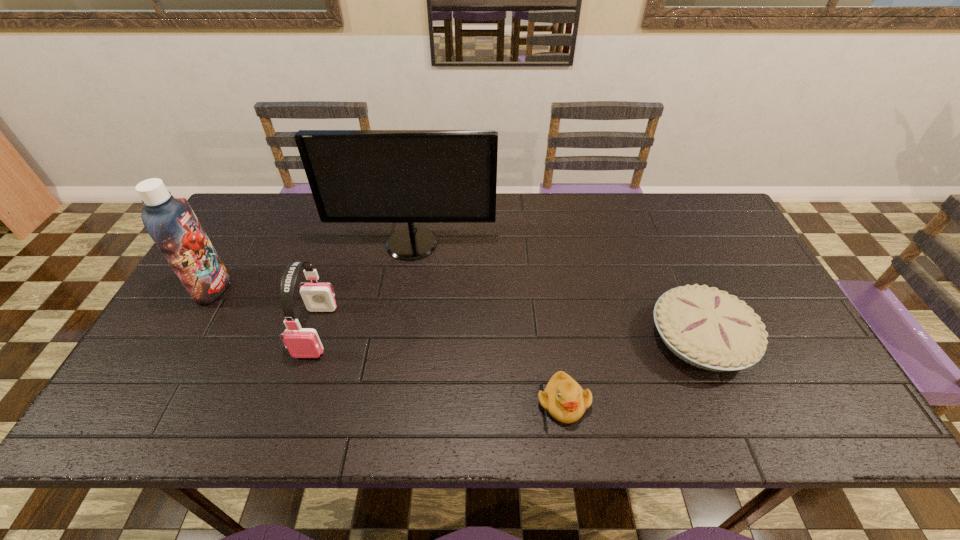
Where is `computer monitor`? The image size is (960, 540). computer monitor is located at coordinates (356, 176).

The height and width of the screenshot is (540, 960). Identify the location of the leftmost object. (171, 223).

The width and height of the screenshot is (960, 540). What are the coordinates of `earphone` in the screenshot? It's located at (318, 297).

Where is `pie`? The height and width of the screenshot is (540, 960). pie is located at coordinates (705, 327).

Locate an element on the screen. duckling is located at coordinates (563, 397).

The width and height of the screenshot is (960, 540). I want to click on vacant space situated 0.130m on the front-facing side of the computer monitor, so click(404, 294).

At what (x,y) coordinates should I click in order to perform the action: click on free space located on the front label of the leftmost object. Please return your answer as a coordinate pair (x, y). Image resolution: width=960 pixels, height=540 pixels. Looking at the image, I should click on (350, 288).

Locate an element on the screen. vacant point located 0.140m on the outer surface of the earphone is located at coordinates (290, 413).

You are a GUI agent. You are given a task and a screenshot of the screen. Output one action in this format:
    pyautogui.click(x=<x>, y=<y>)
    Task: Click on the blank space located 0.160m on the left of the pie
    This screenshot has width=960, height=540.
    Given the screenshot: What is the action you would take?
    click(586, 338)

Image resolution: width=960 pixels, height=540 pixels. What are the coordinates of `object situated at the far edge` in the screenshot? It's located at (356, 176).